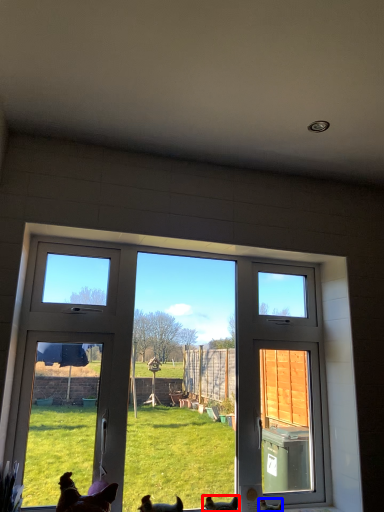
Question: Which of the following is the closest to the observer, chicken (highlighted by a red box) or chicken (highlighted by a blue box)?

Choices:
 (A) chicken
 (B) chicken

Answer: (A)